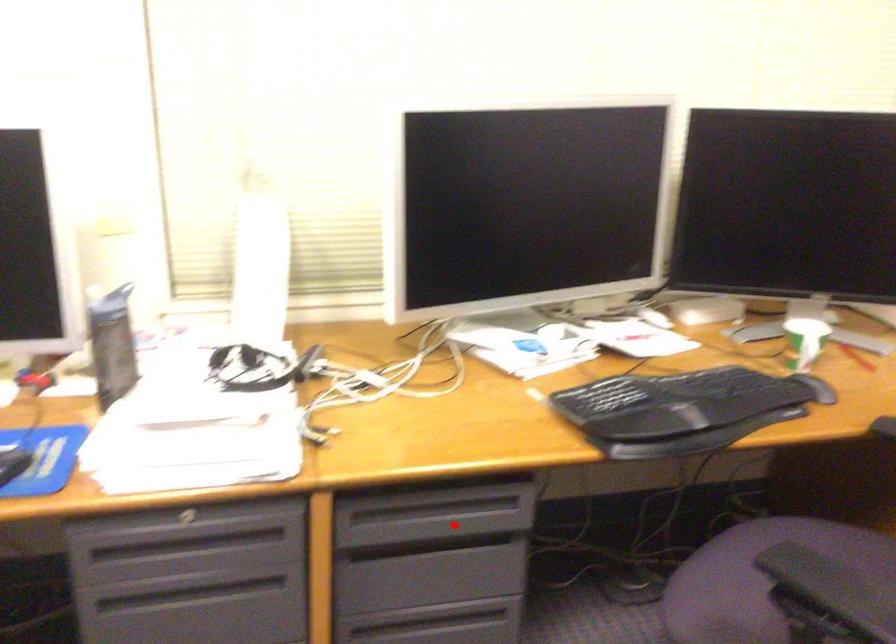
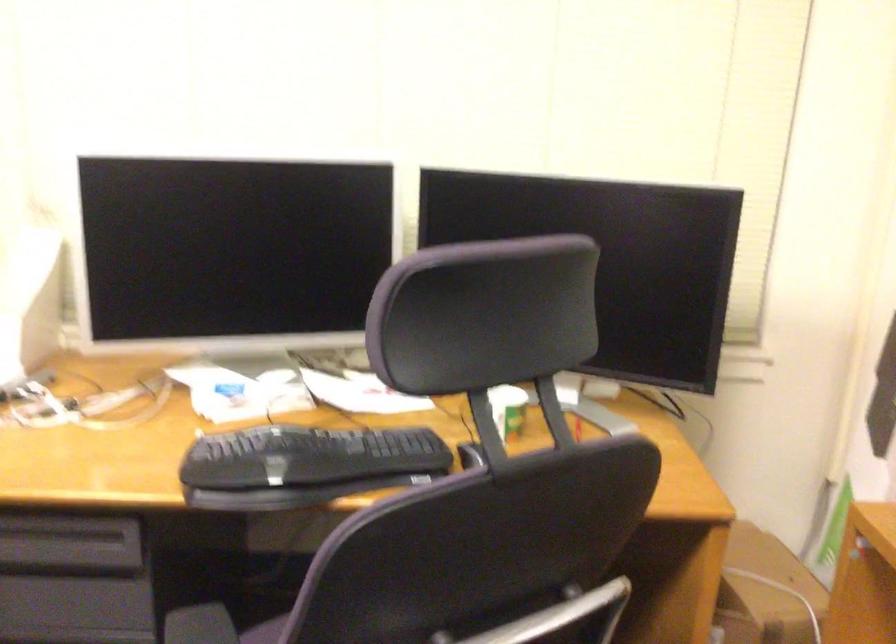
Where in the second image is the point corresponding to the highlighted location from the first image?

(66, 552)